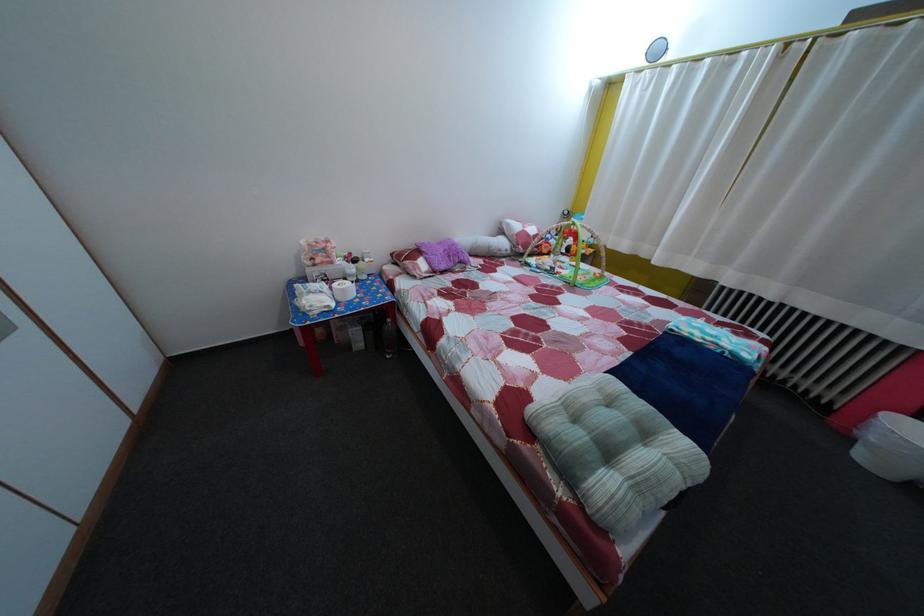
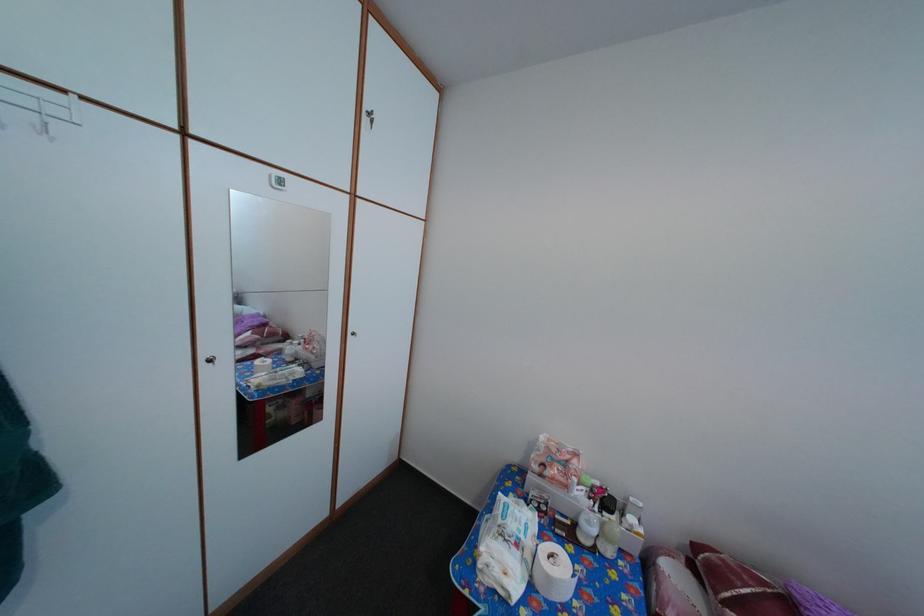
Locate, in the second image, the point that corresponds to point 358,280 in the first image.

(592, 531)